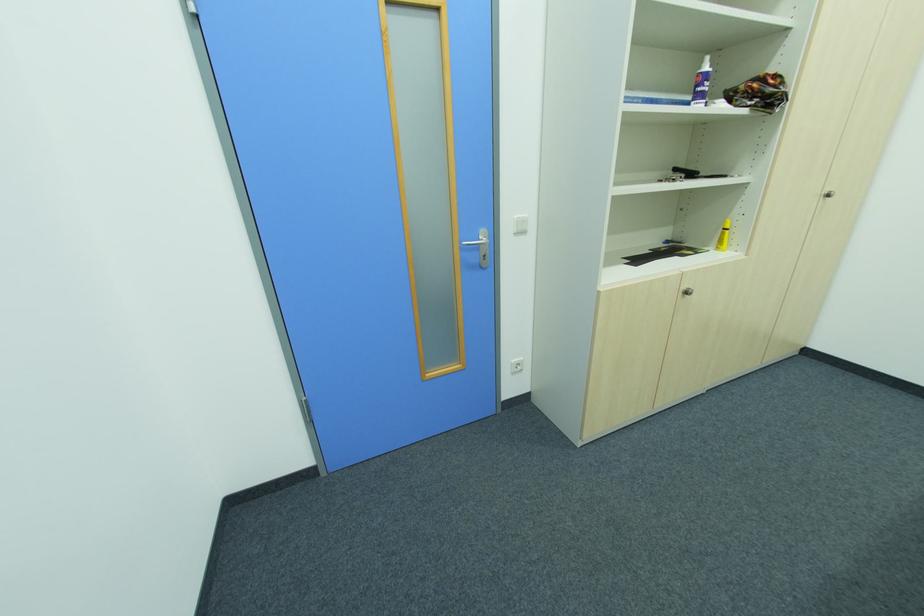
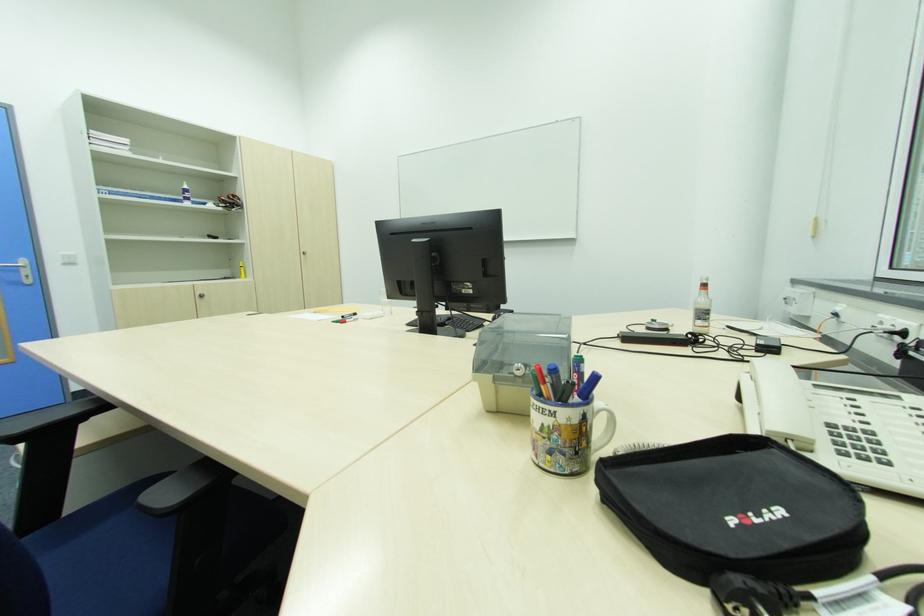
Where in the second image is the point corresponding to point 518,217 from the first image?

(64, 254)